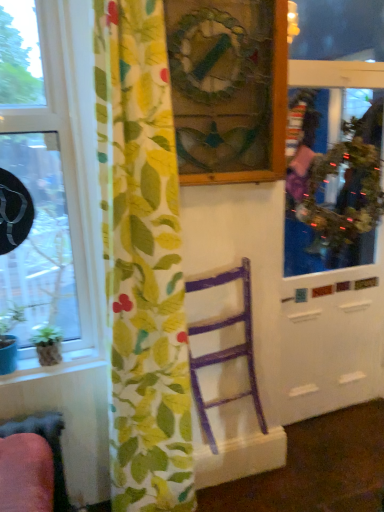
Question: Would you say floral fabric curtain at left is part of metallic reflective screen door at right's contents?

Choices:
 (A) yes
 (B) no

Answer: (B)

Question: Is metallic reflective screen door at right thinner than floral fabric curtain at left?

Choices:
 (A) no
 (B) yes

Answer: (B)

Question: From a real-world perspective, is metallic reflective screen door at right physically below floral fabric curtain at left?

Choices:
 (A) yes
 (B) no

Answer: (A)

Question: Does metallic reflective screen door at right appear on the left side of floral fabric curtain at left?

Choices:
 (A) no
 (B) yes

Answer: (A)

Question: Could you tell me if metallic reflective screen door at right is turned towards floral fabric curtain at left?

Choices:
 (A) yes
 (B) no

Answer: (B)

Question: Relative to purple wood chair at center, is metallic reflective screen door at right in front or behind?

Choices:
 (A) front
 (B) behind

Answer: (B)

Question: Is metallic reflective screen door at right to the left or to the right of purple wood chair at center in the image?

Choices:
 (A) right
 (B) left

Answer: (A)

Question: Looking at the image, does metallic reflective screen door at right seem bigger or smaller compared to purple wood chair at center?

Choices:
 (A) big
 (B) small

Answer: (A)

Question: Does point (291, 411) appear closer or farther from the camera than point (205, 287)?

Choices:
 (A) farther
 (B) closer

Answer: (A)

Question: Is floral fabric curtain at left wider or thinner than transparent glass window at left?

Choices:
 (A) wide
 (B) thin

Answer: (A)

Question: Relative to transparent glass window at left, is floral fabric curtain at left in front or behind?

Choices:
 (A) behind
 (B) front

Answer: (B)

Question: Based on their sizes in the image, would you say floral fabric curtain at left is bigger or smaller than transparent glass window at left?

Choices:
 (A) small
 (B) big

Answer: (B)

Question: From a real-world perspective, is floral fabric curtain at left above or below transparent glass window at left?

Choices:
 (A) above
 (B) below

Answer: (B)

Question: Is floral fabric curtain at left bigger or smaller than green glossy houseplant at lower left?

Choices:
 (A) small
 (B) big

Answer: (B)

Question: Is floral fabric curtain at left wider or thinner than green glossy houseplant at lower left?

Choices:
 (A) wide
 (B) thin

Answer: (A)